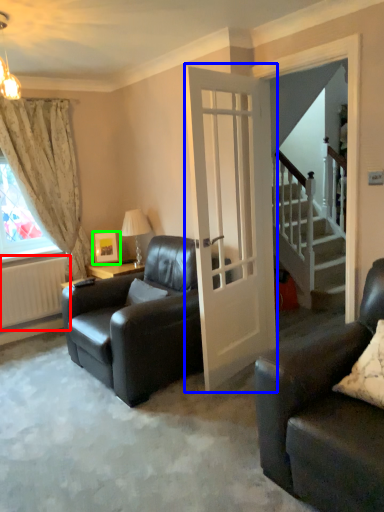
Question: Which object is the closest to the radiator (highlighted by a red box)? Choose among these: door (highlighted by a blue box) or picture frame (highlighted by a green box).

Choices:
 (A) door
 (B) picture frame

Answer: (B)